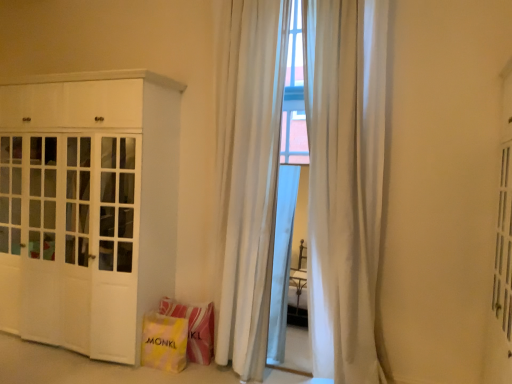
Where is `blank space situated above yellow fabric shopping bag at lower center, the 1th shopping bag from the back (from a real-world perspective)`? Image resolution: width=512 pixels, height=384 pixels. blank space situated above yellow fabric shopping bag at lower center, the 1th shopping bag from the back (from a real-world perspective) is located at coordinates (183, 307).